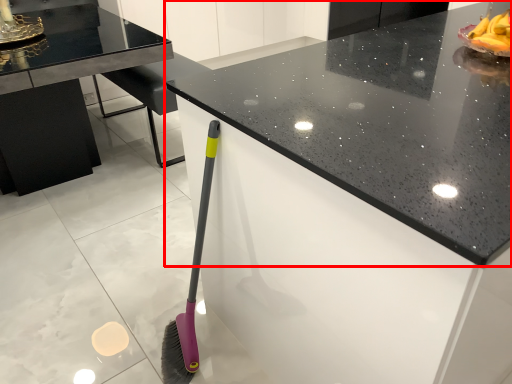
Question: From the image's perspective, where is countertop (annotated by the red box) located in relation to table in the image?

Choices:
 (A) below
 (B) above

Answer: (A)